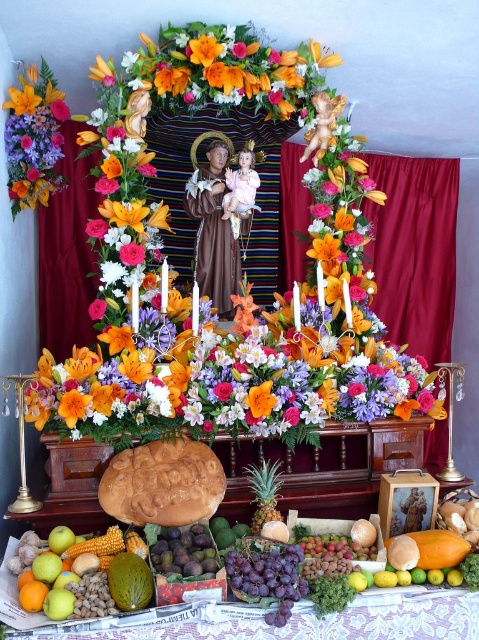
Question: Which object is farther from the camera taking this photo?

Choices:
 (A) green melon at lower left
 (B) lacquered wood table at lower center
 (C) orange matte flower at center

Answer: (C)

Question: Which point is closer to the camera?

Choices:
 (A) matte wood statue at center
 (B) vibrant silk flowers at center
 (C) gold textured statue at upper center

Answer: (B)

Question: Can you confirm if matte orange lily at upper left is positioned to the left of orange matte flower at center?

Choices:
 (A) no
 (B) yes

Answer: (B)

Question: Considering the relative positions of vibrant silk flowers at center and matte wood statue at center in the image provided, where is vibrant silk flowers at center located with respect to matte wood statue at center?

Choices:
 (A) right
 (B) left

Answer: (A)

Question: Which of the following is the closest to the observer?

Choices:
 (A) orange matte flower at center
 (B) matte orange lily at upper left
 (C) green melon at lower left

Answer: (C)

Question: Considering the relative positions of brown statue at center and matte brown statue at center in the image provided, where is brown statue at center located with respect to matte brown statue at center?

Choices:
 (A) left
 (B) right

Answer: (A)